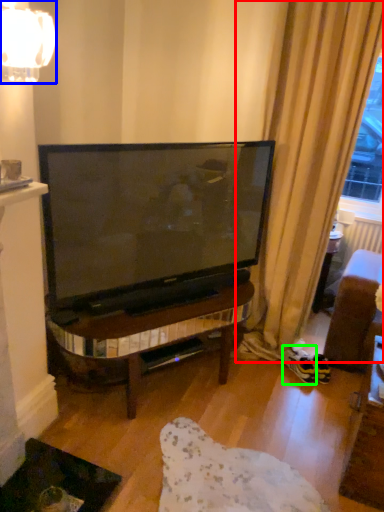
Question: Which is nearer to the curtain (highlighted by a red box)? lamp (highlighted by a blue box) or footwear (highlighted by a green box).

Choices:
 (A) lamp
 (B) footwear

Answer: (B)